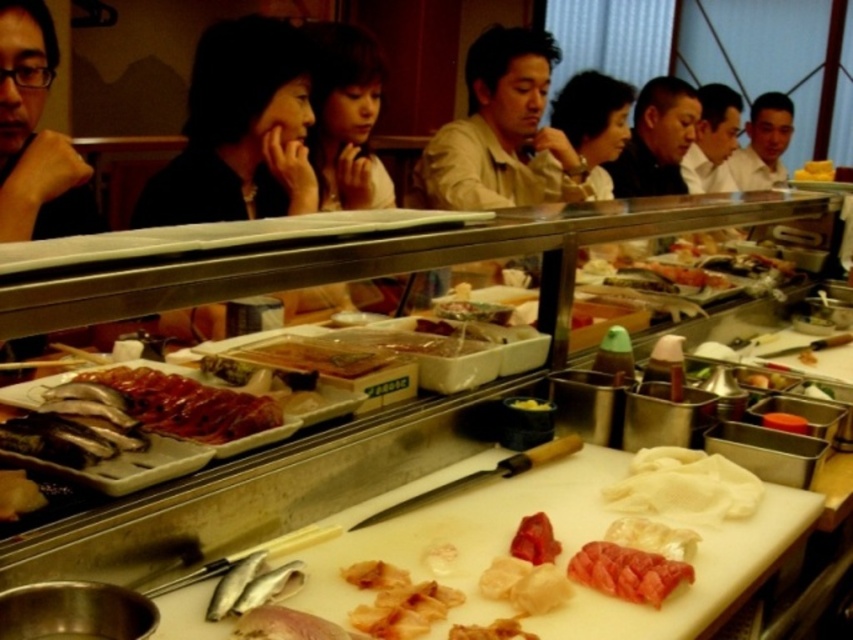
Identify the location of pink raw fish at center. This screenshot has height=640, width=853. (627, 572).

The width and height of the screenshot is (853, 640). What do you see at coordinates (627, 572) in the screenshot?
I see `pink raw fish at center` at bounding box center [627, 572].

Where is `pink raw fish at center`? This screenshot has height=640, width=853. pink raw fish at center is located at coordinates (627, 572).

Can you confirm if shiny red meat at center is thinner than pink raw fish at center?

No, shiny red meat at center is not thinner than pink raw fish at center.

Can you confirm if shiny red meat at center is positioned to the left of pink raw fish at center?

Indeed, shiny red meat at center is positioned on the left side of pink raw fish at center.

Image resolution: width=853 pixels, height=640 pixels. What do you see at coordinates (187, 404) in the screenshot? I see `shiny red meat at center` at bounding box center [187, 404].

This screenshot has width=853, height=640. Find the location of `shiny red meat at center`. shiny red meat at center is located at coordinates (187, 404).

Is pink glossy raw fish at center smaller than yellow matte sushi at upper right?

Indeed, pink glossy raw fish at center has a smaller size compared to yellow matte sushi at upper right.

Can you confirm if pink glossy raw fish at center is wider than yellow matte sushi at upper right?

No.

What are the coordinates of `pink glossy raw fish at center` in the screenshot? It's located at (534, 540).